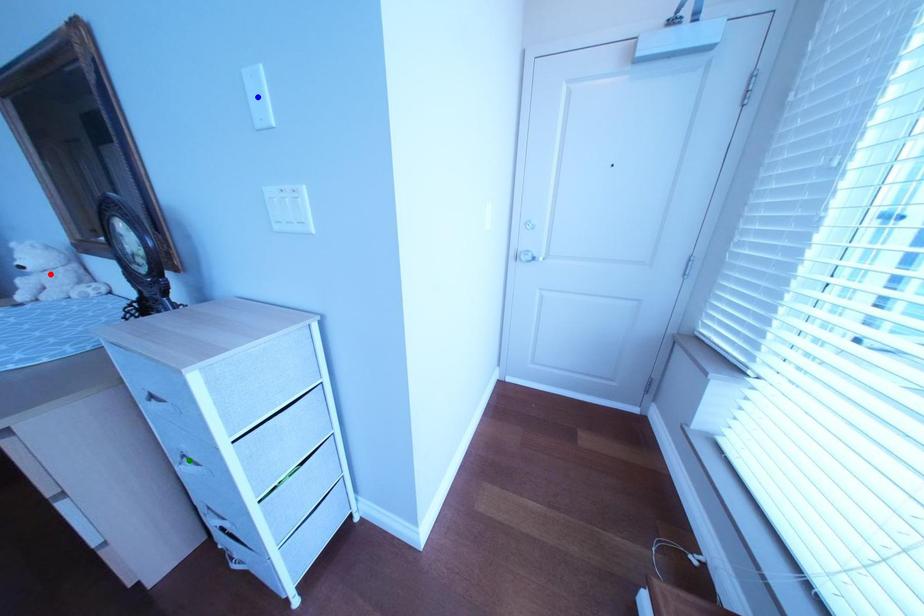
From the picture: Order these from nearest to farthest:
1. red point
2. blue point
3. green point

red point
green point
blue point